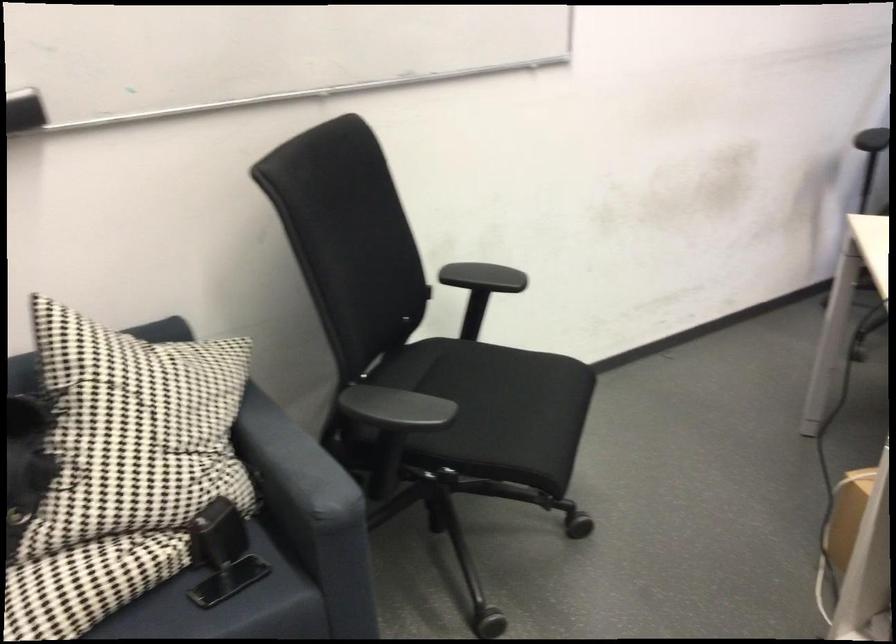
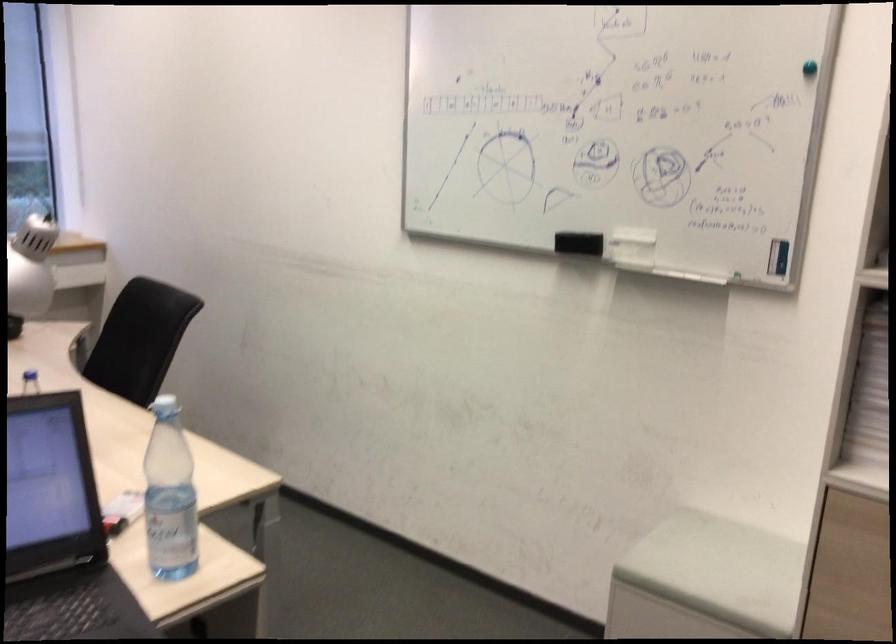
In the scene shown: How did the camera likely rotate?

The camera rotated toward right-down.